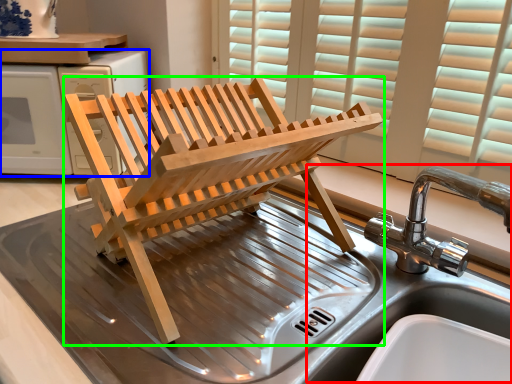
Question: Estimate the real-world distances between objects in this image. Which object is farther from sink (highlighted by a red box), appliance (highlighted by a blue box) or furniture (highlighted by a green box)?

Choices:
 (A) appliance
 (B) furniture

Answer: (A)